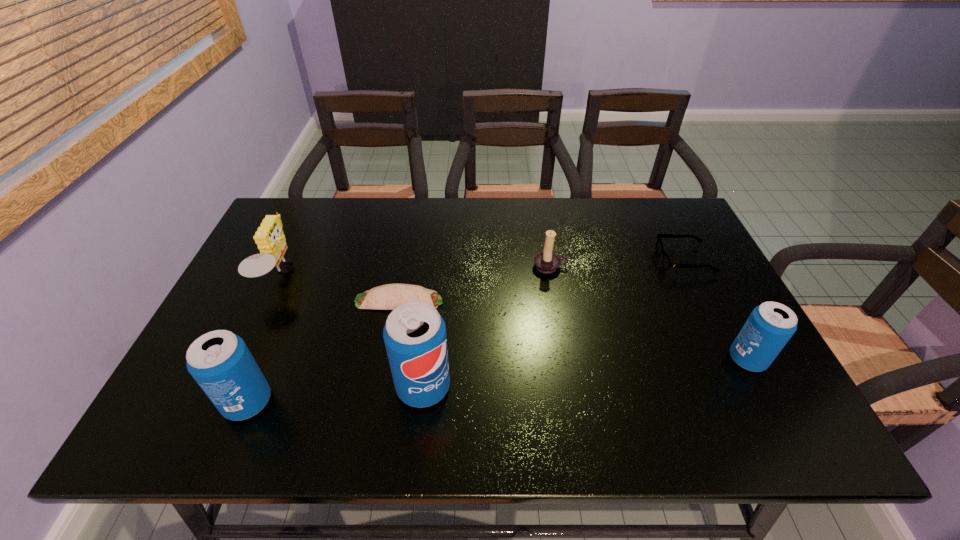
Identify the location of spectacles positioned at the right edge. The height and width of the screenshot is (540, 960). (666, 261).

Identify the location of object that is positioned at the near left corner. This screenshot has width=960, height=540. (220, 362).

Identify the location of object that is at the near right corner. coord(769,327).

Identify the location of vacant area at the far edge of the desktop. (584, 220).

You are a GUI agent. You are given a task and a screenshot of the screen. Output one action in this format:
    pyautogui.click(x=<x>, y=<y>)
    Task: Click on the vacant space at the near edge of the desktop
    This screenshot has width=960, height=540.
    Given the screenshot: What is the action you would take?
    pyautogui.click(x=538, y=395)

This screenshot has width=960, height=540. In order to click on vacant space at the left edge of the desktop in this screenshot , I will do `click(267, 289)`.

What are the coordinates of `vacant region at the right edge` in the screenshot? It's located at (691, 304).

What are the coordinates of `free space at the far right corner` in the screenshot? It's located at (674, 239).

Identify the location of vacant area between the second tallest soda can and the rightmost soda can. This screenshot has width=960, height=540. (497, 381).

Locate an element on the screen. vacant point located between the second shortest object and the shortest soda can is located at coordinates (716, 310).